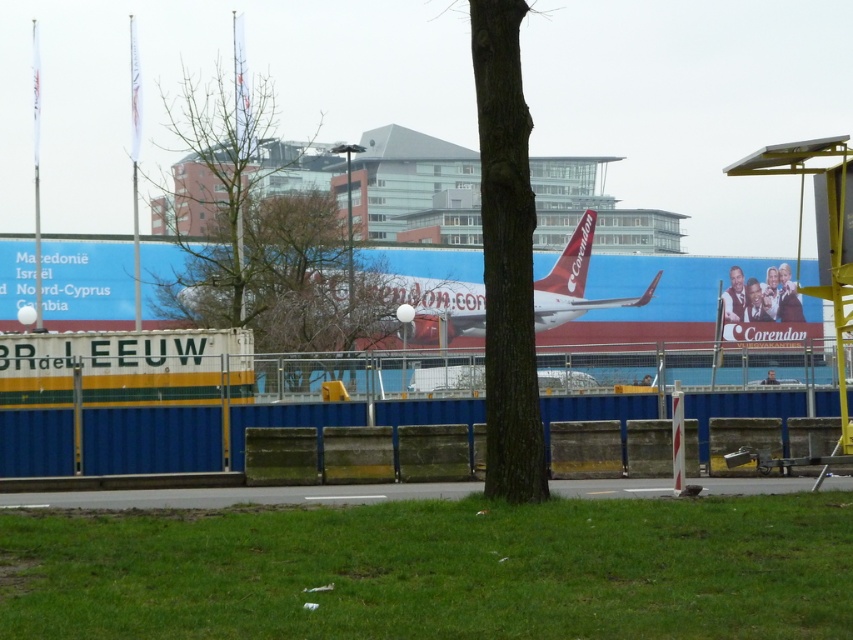
Question: Which point appears closest to the camera in this image?

Choices:
 (A) (561, 323)
 (B) (297, 497)

Answer: (B)

Question: Is gray asphalt at lower center wider than red matte airliner at center?

Choices:
 (A) yes
 (B) no

Answer: (B)

Question: Observing the image, what is the correct spatial positioning of gray asphalt at lower center in reference to red matte airliner at center?

Choices:
 (A) right
 (B) left

Answer: (A)

Question: Among these objects, which one is nearest to the camera?

Choices:
 (A) gray asphalt at lower center
 (B) red matte airliner at center

Answer: (B)

Question: Can you confirm if gray asphalt at lower center is positioned to the left of red matte airliner at center?

Choices:
 (A) yes
 (B) no

Answer: (B)